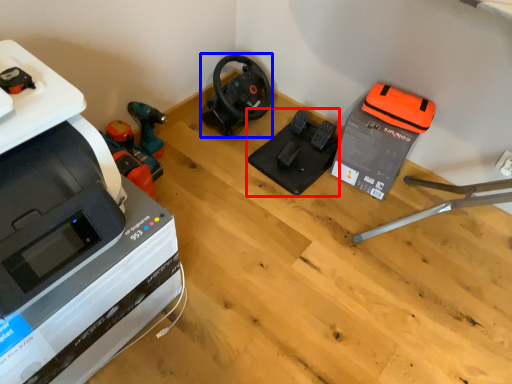
Question: Among these objects, which one is farthest to the camera, equipment (highlighted by a red box) or vacuum (highlighted by a blue box)?

Choices:
 (A) equipment
 (B) vacuum

Answer: (B)